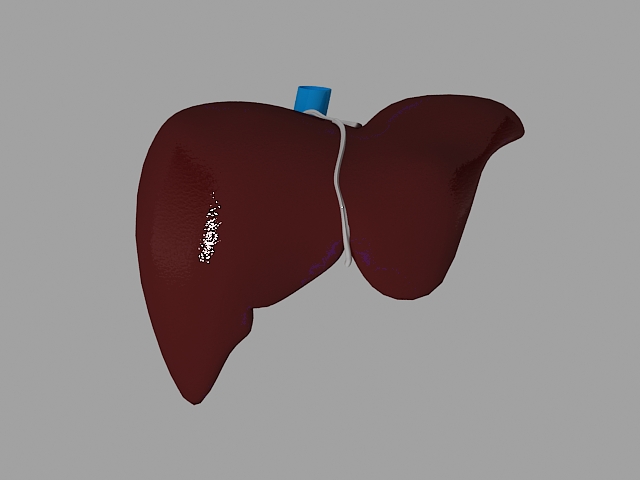
I want to click on organ, so click(x=212, y=133).